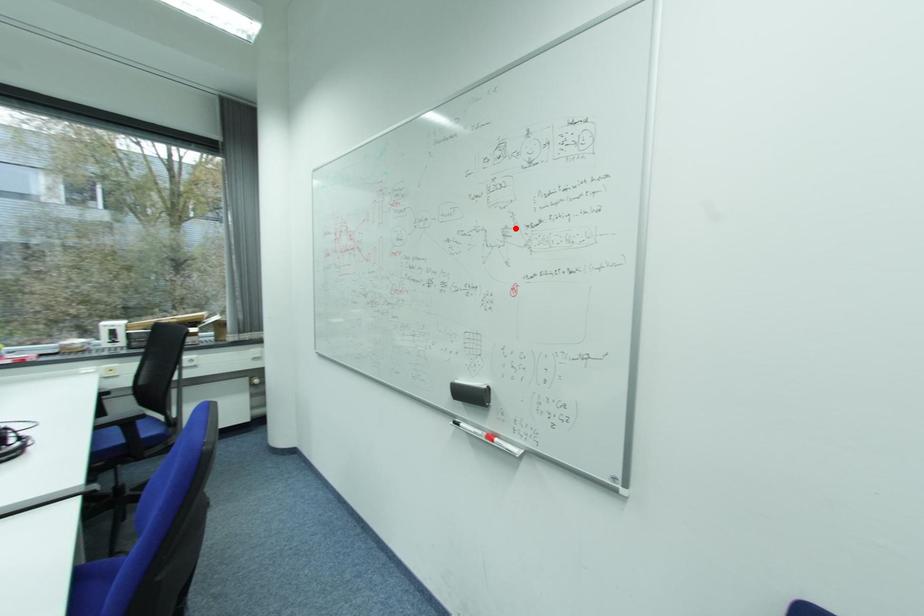
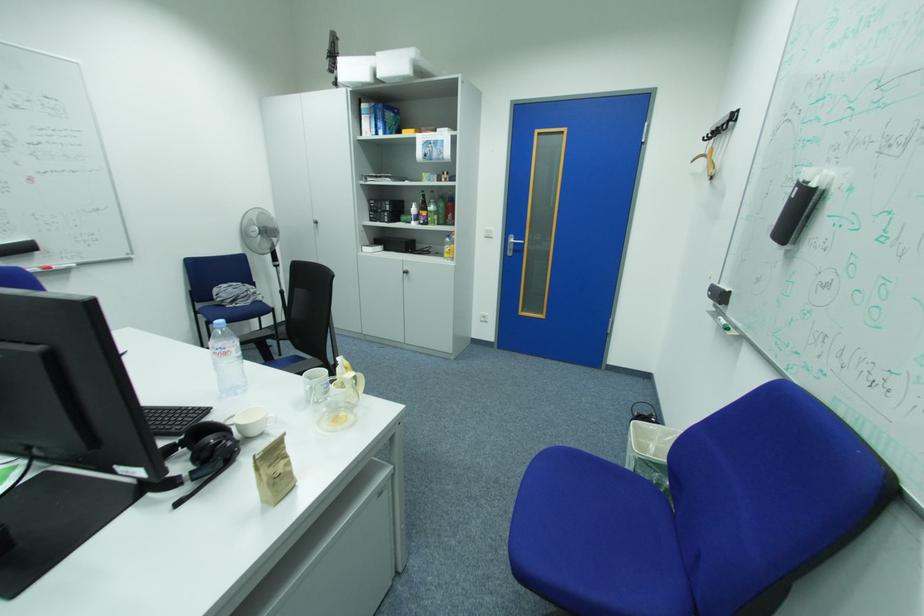
Question: I am providing you with two images of the same scene from different viewpoints. In image1, a red point is highlighted. Considering the same 3D point in image2, which of the following is correct?

Choices:
 (A) It is closer
 (B) It is farther

Answer: (B)